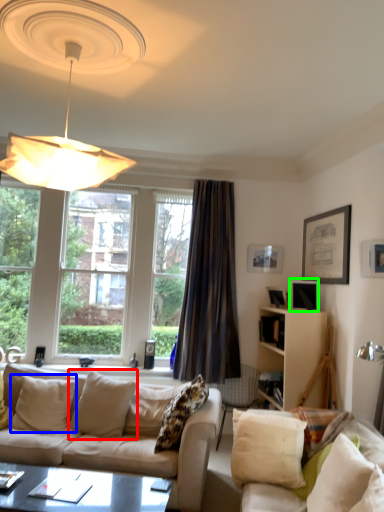
Question: Considering the real-world distances, which object is closest to pillow (highlighted by a red box)? pillow (highlighted by a blue box) or picture frame (highlighted by a green box).

Choices:
 (A) pillow
 (B) picture frame

Answer: (A)